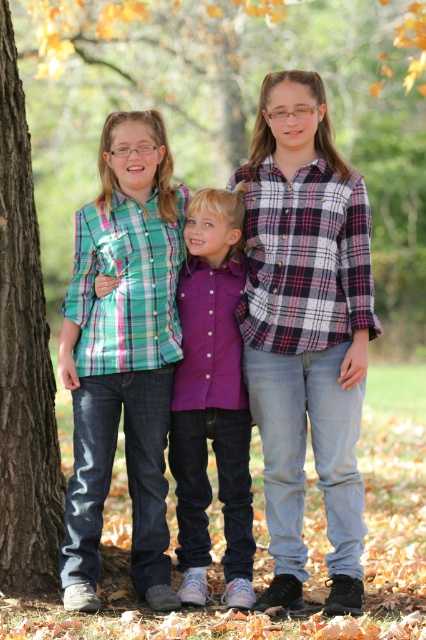
You are a photographer standing in the park and want to take a photo of the plaid shirt at center and the brown rough bark at left. If your camera has a maximum focus range of 1.5 meters, will both subjects be in focus?

The distance between the plaid shirt at center and the brown rough bark at left is 1.52 meters. Since the camera can only focus up to 1.5 meters, the subjects will be slightly out of focus.

Based on the scene description, where is the plaid flannel shirt at center located in the image?

The plaid flannel shirt at center is located at point coordinates of 0.517 on the x axis and 0.718 on the y axis.

You are a photographer trying to capture a group photo of the plaid flannel shirt at center and the matte plaid shirt at left. Since you want to ensure both shirts are fully visible in the frame, which shirt should you focus on adjusting the camera angle to accommodate its height?

The plaid flannel shirt at center has a greater height compared to the matte plaid shirt at left, so you should focus on adjusting the camera angle to accommodate the plaid flannel shirt at center to ensure both shirts are fully visible in the frame.